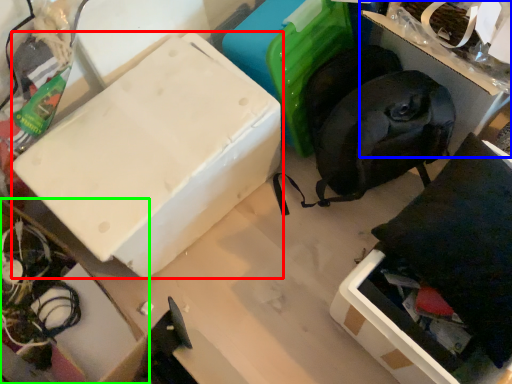
Question: Based on their relative distances, which object is farther from box (highlighted by a red box)? Choose from storage box (highlighted by a blue box) and cardboard box (highlighted by a green box).

Choices:
 (A) storage box
 (B) cardboard box

Answer: (A)